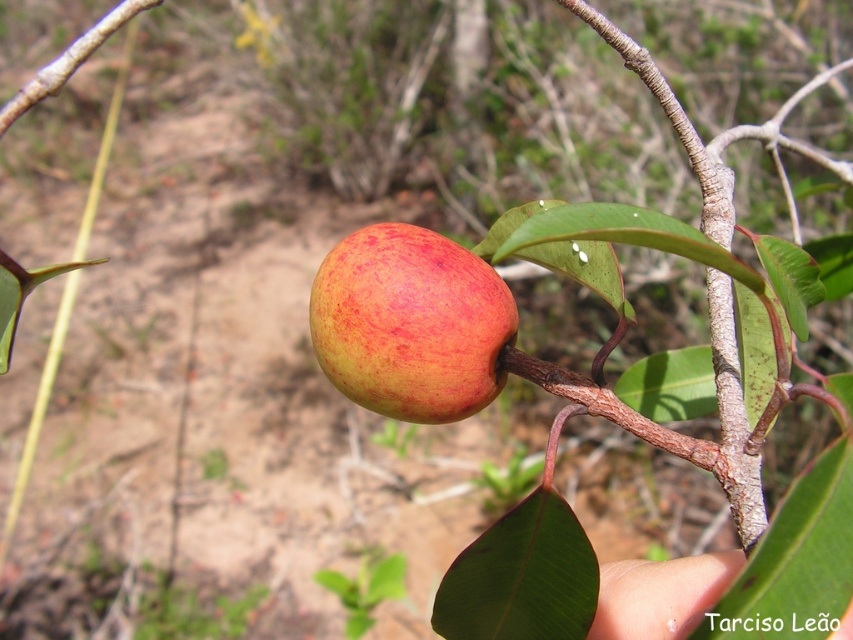
You are an apple picker standing on the ground looking up at the ripe red apple at center and the pale skin at lower right. Which object is higher in the scene?

The ripe red apple at center is higher than the pale skin at lower right.

You are an apple farmer checking the ripeness of fruits. You notice a ripe red apple at center and a pale skin at lower right. Which fruit is wider?

The ripe red apple at center is wider than the pale skin at lower right.